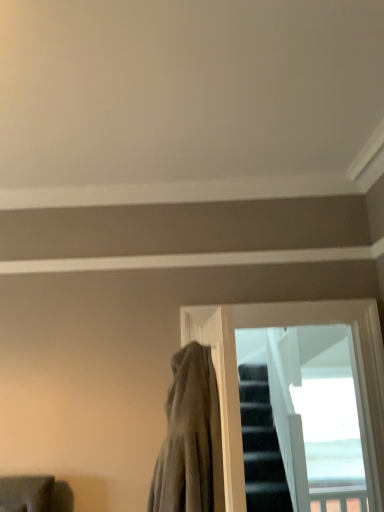
Question: In the image, is gray cotton cloak at center on the left side or the right side of transparent glass window at center?

Choices:
 (A) left
 (B) right

Answer: (A)

Question: Does point (170, 453) appear closer or farther from the camera than point (379, 446)?

Choices:
 (A) closer
 (B) farther

Answer: (A)

Question: From the image's perspective, is gray cotton cloak at center above or below transparent glass window at center?

Choices:
 (A) above
 (B) below

Answer: (A)

Question: Looking at their shapes, would you say transparent glass window at center is wider or thinner than gray cotton cloak at center?

Choices:
 (A) thin
 (B) wide

Answer: (A)

Question: Is point (309, 320) positioned closer to the camera than point (213, 387)?

Choices:
 (A) closer
 (B) farther

Answer: (B)

Question: Would you say transparent glass window at center is to the left or to the right of gray cotton cloak at center in the picture?

Choices:
 (A) right
 (B) left

Answer: (A)

Question: Considering the positions of transparent glass window at center and gray cotton cloak at center in the image, is transparent glass window at center taller or shorter than gray cotton cloak at center?

Choices:
 (A) tall
 (B) short

Answer: (A)